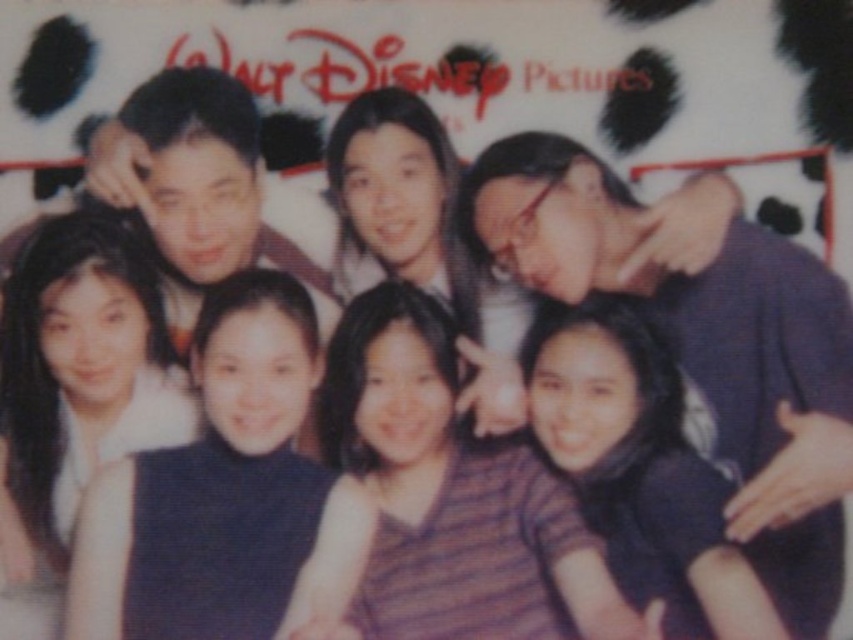
Question: Which of the following is the farthest from the observer?

Choices:
 (A) (45, 234)
 (B) (152, 168)

Answer: (B)

Question: Based on their relative distances, which object is nearer to the matte purple shirt at center?

Choices:
 (A) striped fabric shirt at center
 (B) striped fabric shirt at lower center
 (C) matte black man at center

Answer: (A)

Question: Considering the real-world distances, which object is closest to the smooth black dress at lower left?

Choices:
 (A) striped fabric shirt at lower center
 (B) dark blue dress at center
 (C) matte black man at center

Answer: (B)

Question: Does matte black man at center have a greater width compared to dark blue dress at center?

Choices:
 (A) no
 (B) yes

Answer: (B)

Question: From the image, what is the correct spatial relationship of striped fabric shirt at center in relation to matte purple shirt at center?

Choices:
 (A) below
 (B) above

Answer: (A)

Question: Does smooth black dress at lower left appear on the left side of striped fabric shirt at lower center?

Choices:
 (A) yes
 (B) no

Answer: (A)